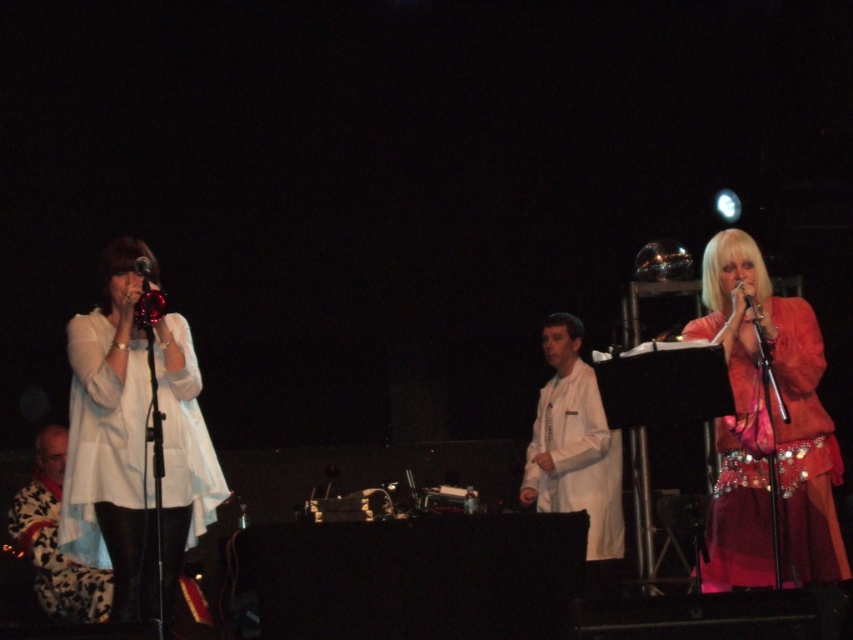
Is shiny red dress at right smaller than floral-patterned coat at lower left?

Incorrect, shiny red dress at right is not smaller in size than floral-patterned coat at lower left.

Looking at this image, who is positioned more to the left, shiny red dress at right or floral-patterned coat at lower left?

Positioned to the left is floral-patterned coat at lower left.

Identify the location of shiny red dress at right. The image size is (853, 640). (773, 428).

This screenshot has width=853, height=640. I want to click on white matte dress at left, so click(x=111, y=440).

Does white matte dress at left lie behind floral-patterned coat at lower left?

No, white matte dress at left is closer to the viewer.

Which is in front, point (196, 529) or point (70, 612)?

Point (196, 529) is in front.

At what (x,y) coordinates should I click in order to perform the action: click on white matte dress at left. Please return your answer as a coordinate pair (x, y). Image resolution: width=853 pixels, height=640 pixels. Looking at the image, I should click on (111, 440).

Can you confirm if white matte coat at center is wider than floral-patterned coat at lower left?

Incorrect, white matte coat at center's width does not surpass floral-patterned coat at lower left's.

Is white matte coat at center below floral-patterned coat at lower left?

Incorrect, white matte coat at center is not positioned below floral-patterned coat at lower left.

Is point (585, 557) positioned before point (73, 605)?

Yes, point (585, 557) is in front of point (73, 605).

Where is `white matte coat at center`? white matte coat at center is located at coordinates (573, 444).